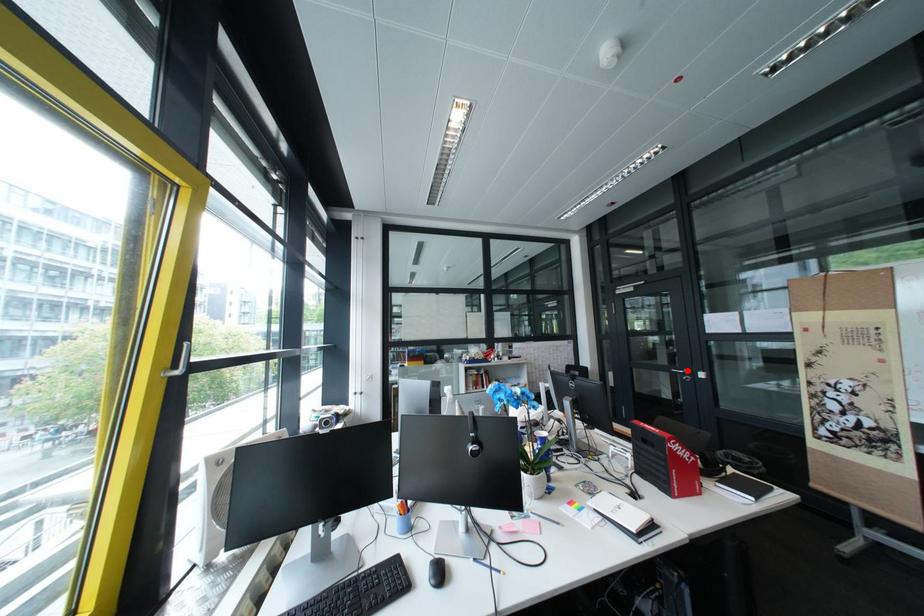
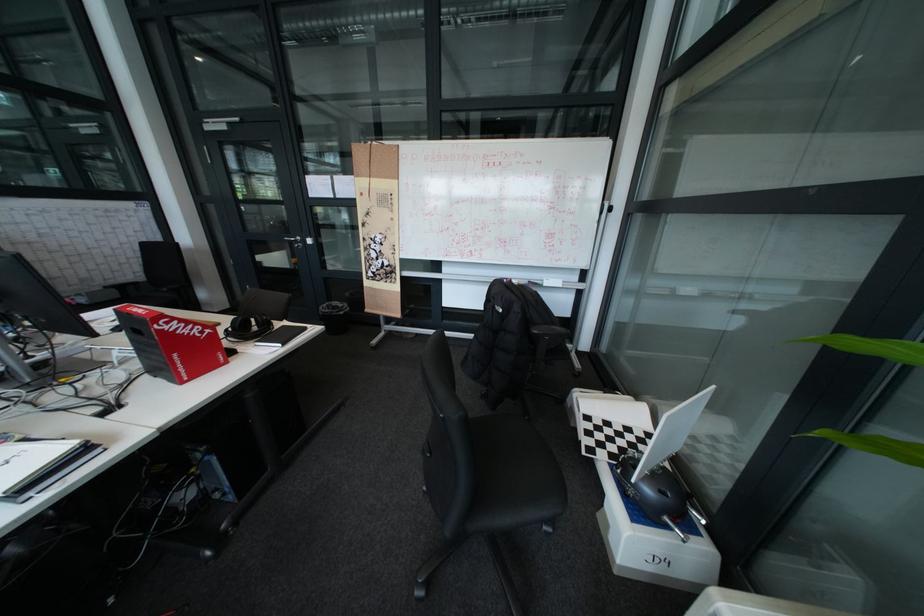
In the second image, find the point that corresponds to the highlighted location in the first image.

(299, 238)